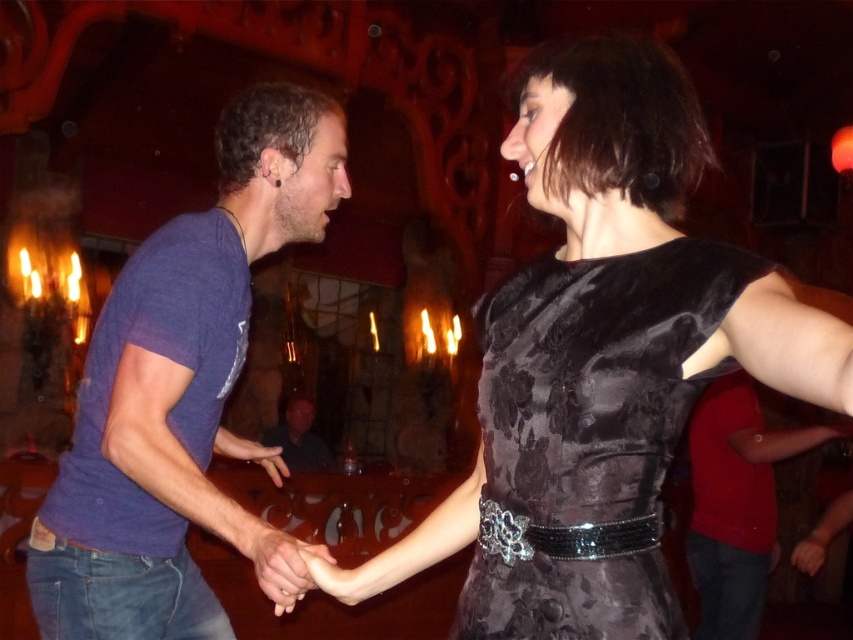
Does point (131, 637) come behind point (730, 554)?

That is False.

Does matte blue t-shirt at left appear on the right side of matte blue shirt at left?

In fact, matte blue t-shirt at left is to the left of matte blue shirt at left.

Where is `matte blue t-shirt at left`? Image resolution: width=853 pixels, height=640 pixels. matte blue t-shirt at left is located at coordinates (178, 387).

Is satin black dress at center bigger than velvet black dress at center?

Yes, satin black dress at center is bigger than velvet black dress at center.

Is point (558, 545) farther from camera compared to point (538, 262)?

No, it is not.

The height and width of the screenshot is (640, 853). I want to click on satin black dress at center, so click(601, 358).

Based on the photo, who is lower down, matte blue t-shirt at left or smooth skin hand at center?

smooth skin hand at center

Does matte blue t-shirt at left have a lesser width compared to smooth skin hand at center?

No.

Between point (292, 104) and point (300, 570), which one is positioned in front?

Point (300, 570) is more forward.

Identify the location of matte blue t-shirt at left. The width and height of the screenshot is (853, 640). (178, 387).